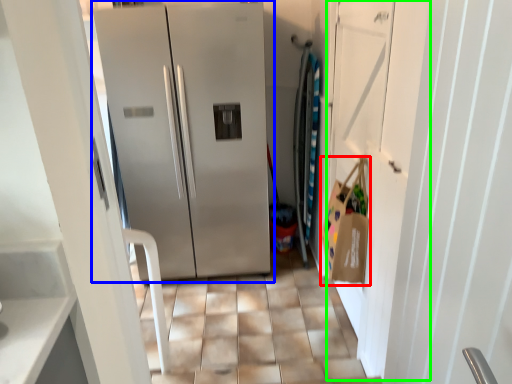
Question: Based on their relative distances, which object is nearer to shopping bag (highlighted by a red box)? Choose from refrigerator (highlighted by a blue box) and door (highlighted by a green box).

Choices:
 (A) refrigerator
 (B) door

Answer: (B)